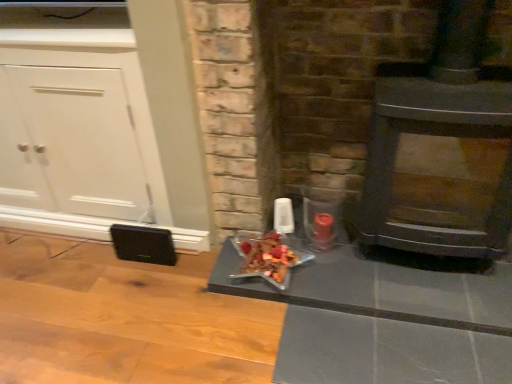
Question: Is matte black fireplace at center not within shiny metallic star at center?

Choices:
 (A) no
 (B) yes

Answer: (B)

Question: Is shiny metallic star at center completely or partially inside matte black fireplace at center?

Choices:
 (A) yes
 (B) no

Answer: (A)

Question: Does matte black fireplace at center have a larger size compared to shiny metallic star at center?

Choices:
 (A) no
 (B) yes

Answer: (B)

Question: Can you confirm if matte black fireplace at center is taller than shiny metallic star at center?

Choices:
 (A) no
 (B) yes

Answer: (B)

Question: From a real-world perspective, is matte black fireplace at center physically above shiny metallic star at center?

Choices:
 (A) no
 (B) yes

Answer: (B)

Question: In the image, is wooden panel stove at right on the left side or the right side of shiny metallic star at center?

Choices:
 (A) left
 (B) right

Answer: (B)

Question: Which is correct: wooden panel stove at right is inside shiny metallic star at center, or outside of it?

Choices:
 (A) inside
 (B) outside

Answer: (B)

Question: From the image's perspective, is wooden panel stove at right located above or below shiny metallic star at center?

Choices:
 (A) above
 (B) below

Answer: (A)

Question: Is point (479, 13) closer or farther from the camera than point (275, 249)?

Choices:
 (A) closer
 (B) farther

Answer: (A)

Question: Is shiny metallic star at center taller or shorter than matte black fireplace at center?

Choices:
 (A) tall
 (B) short

Answer: (B)

Question: Considering the positions of point (276, 279) and point (217, 125), is point (276, 279) closer or farther from the camera than point (217, 125)?

Choices:
 (A) closer
 (B) farther

Answer: (B)

Question: From a real-world perspective, is shiny metallic star at center above or below matte black fireplace at center?

Choices:
 (A) above
 (B) below

Answer: (B)

Question: Is shiny metallic star at center bigger or smaller than matte black fireplace at center?

Choices:
 (A) big
 (B) small

Answer: (B)

Question: Would you say white matte cabinet at left is to the left or to the right of matte black fireplace at center in the picture?

Choices:
 (A) left
 (B) right

Answer: (A)

Question: Is point (61, 152) closer or farther from the camera than point (245, 137)?

Choices:
 (A) farther
 (B) closer

Answer: (A)